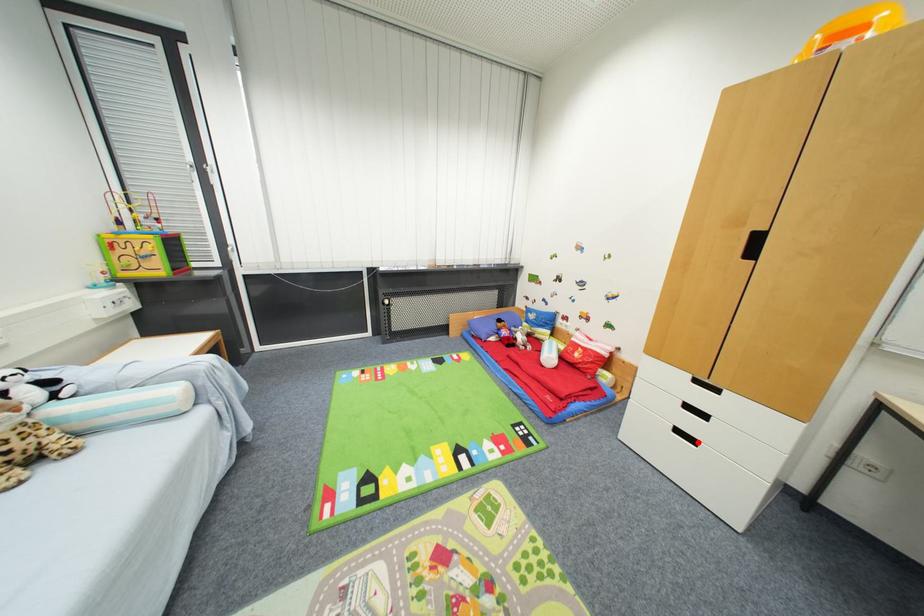
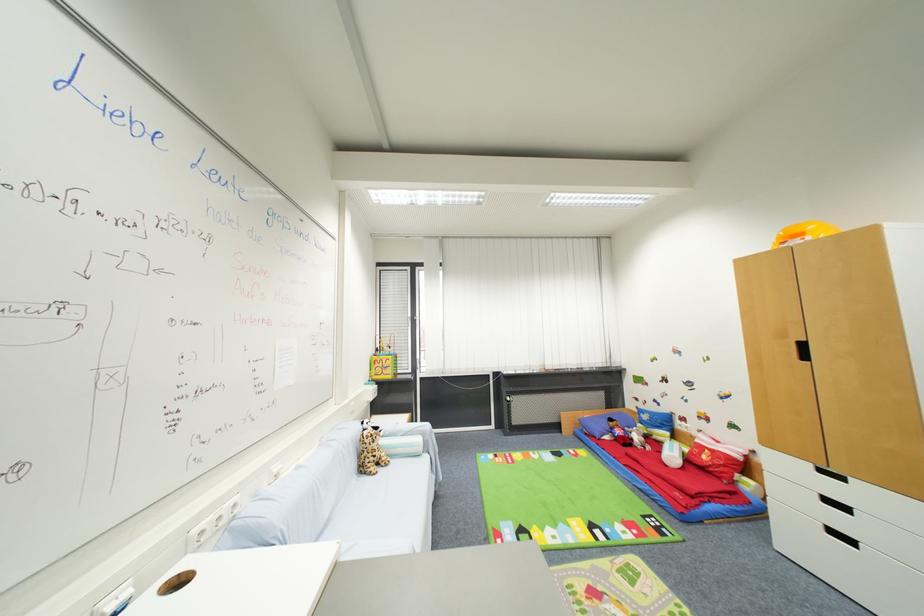
Question: I am providing you with two images of the same scene from different viewpoints. A red point is shown in image1. For the corresponding object point in image2, is it positioned nearer or farther from the camera?

Choices:
 (A) Nearer
 (B) Farther

Answer: (A)